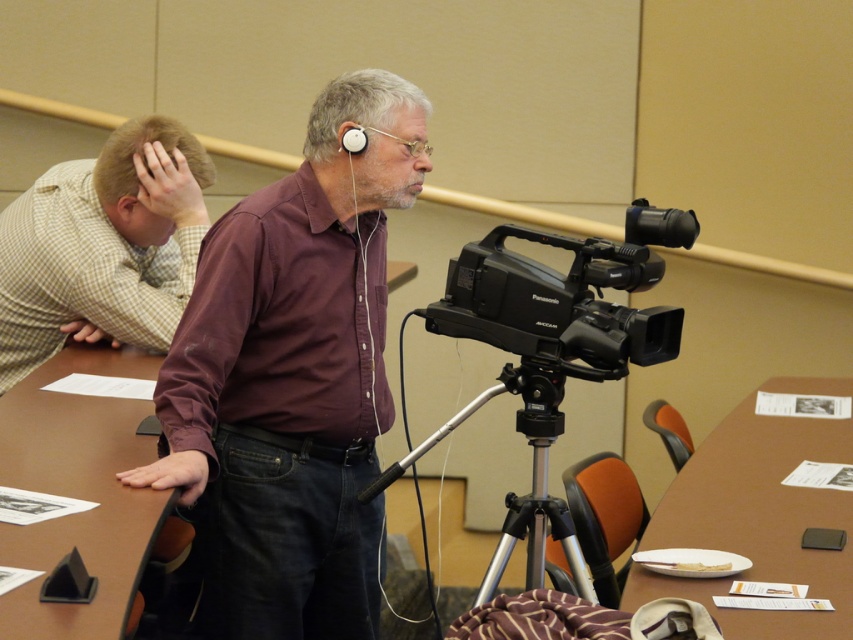
Which of these two, black plastic video camera at center or white plastic earphone at upper center, stands shorter?

white plastic earphone at upper center is shorter.

Does point (653, 324) lie behind point (347, 131)?

That is False.

Between point (666, 321) and point (352, 141), which one is positioned in front?

Positioned in front is point (666, 321).

Where is `black plastic video camera at center`? Image resolution: width=853 pixels, height=640 pixels. black plastic video camera at center is located at coordinates (552, 349).

Which is behind, point (772, 464) or point (531, 506)?

The point (772, 464) is behind.

How distant is brown wood table at lower right from silver metallic tripod at center?

brown wood table at lower right and silver metallic tripod at center are 21.18 inches apart from each other.

Is point (686, 592) closer to camera compared to point (523, 515)?

Yes, it is in front of point (523, 515).

Where is `brown wood table at lower right`? brown wood table at lower right is located at coordinates (757, 522).

Who is higher up, brown wood table at lower right or black plastic camera at center?

Positioned higher is black plastic camera at center.

Is point (821, 561) more distant than point (677, 225)?

Yes, point (821, 561) is farther from viewer.

The height and width of the screenshot is (640, 853). Find the location of `brown wood table at lower right`. brown wood table at lower right is located at coordinates (757, 522).